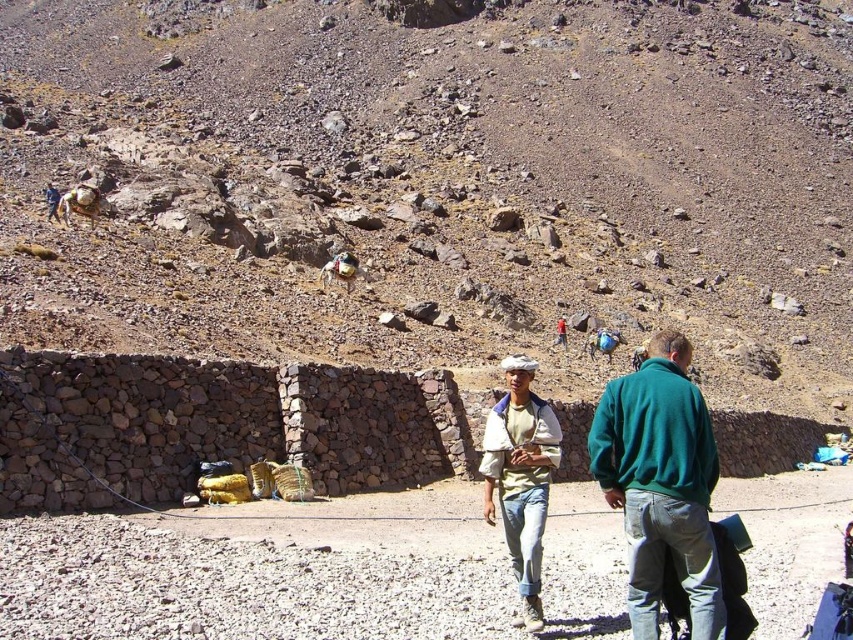
Question: Is green fleece jacket at lower right to the right of brown fuzzy donkey at center from the viewer's perspective?

Choices:
 (A) yes
 (B) no

Answer: (A)

Question: Which object is farther from the camera taking this photo?

Choices:
 (A) light beige cotton shirt at center
 (B) brown fuzzy donkey at center
 (C) green fleece jacket at lower right

Answer: (B)

Question: Is light beige cotton shirt at center positioned behind brown fuzzy donkey at center?

Choices:
 (A) yes
 (B) no

Answer: (B)

Question: Does light beige cotton shirt at center appear on the left side of brown fuzzy donkey at center?

Choices:
 (A) no
 (B) yes

Answer: (A)

Question: Which point is closer to the camera?

Choices:
 (A) light beige cotton shirt at center
 (B) brown fuzzy donkey at center

Answer: (A)

Question: Which of the following is the closest to the observer?

Choices:
 (A) light beige cotton shirt at center
 (B) brown fuzzy donkey at center
 (C) green fleece jacket at lower right

Answer: (C)